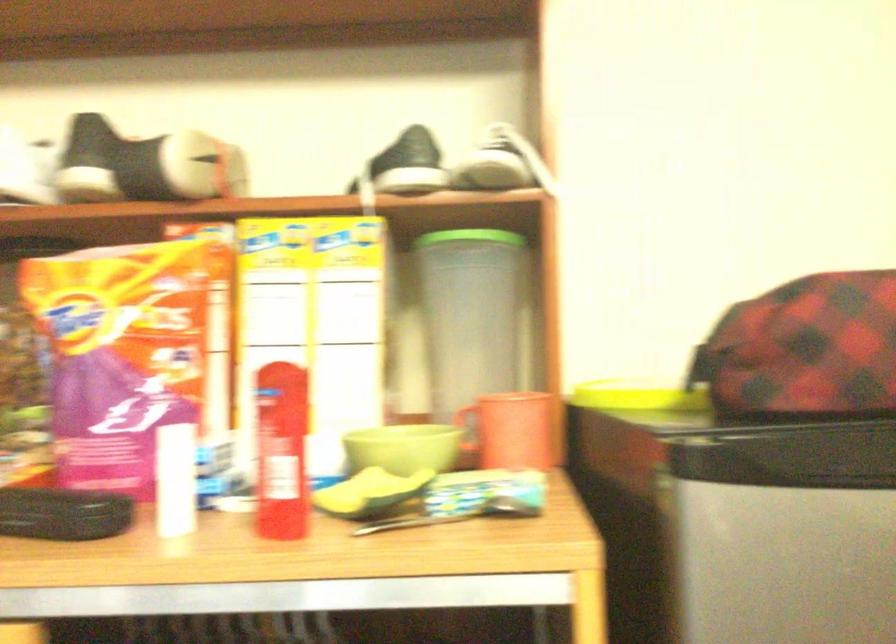
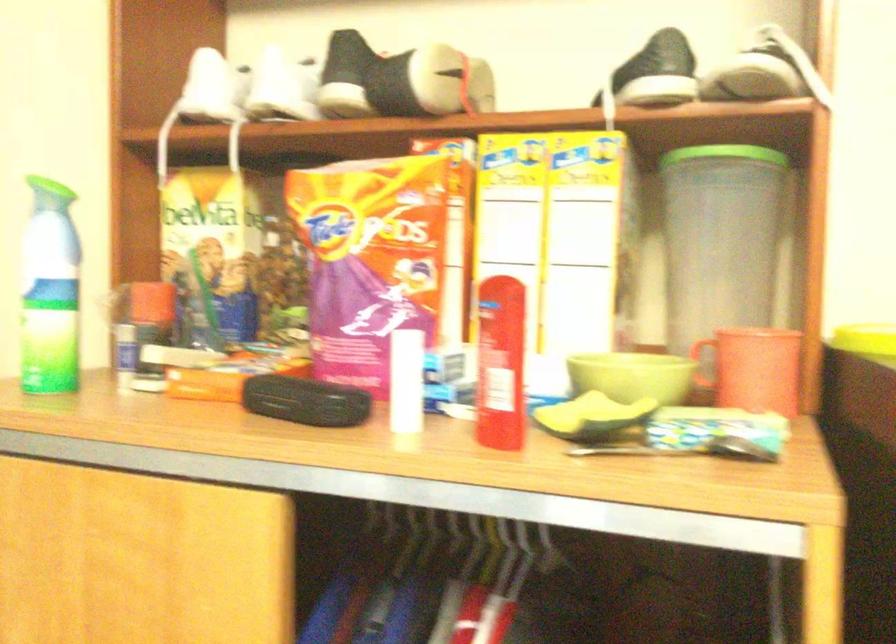
Where in the second image is the point corresponding to the point at 286,451 from the first image?

(501, 364)